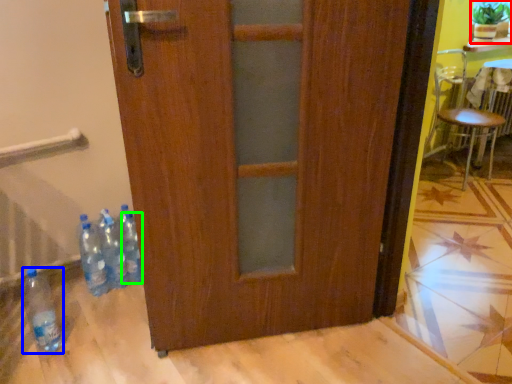
Question: Considering the real-world distances, which object is farthest from houseplant (highlighted by a red box)? bottle (highlighted by a blue box) or bottle (highlighted by a green box)?

Choices:
 (A) bottle
 (B) bottle

Answer: (A)